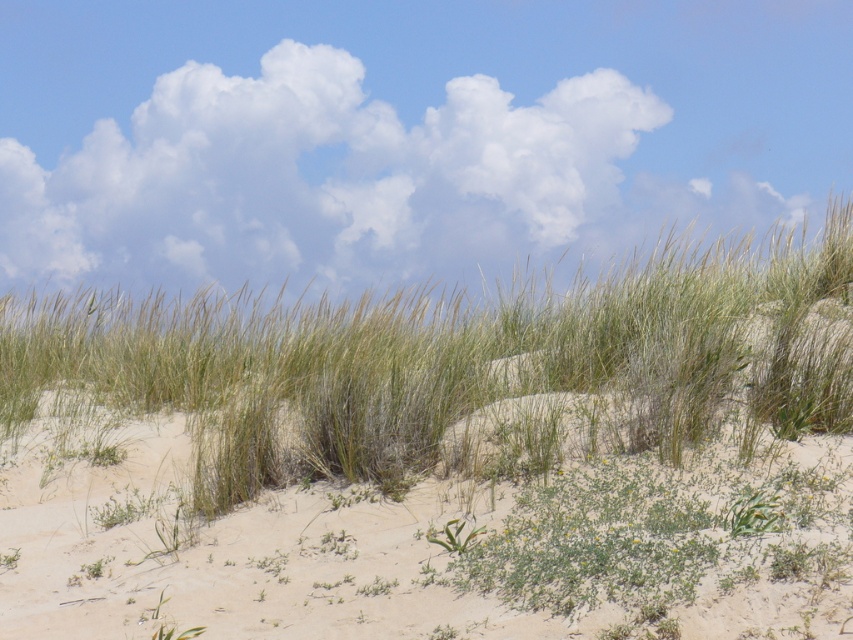
Question: Which point is farther from the camera taking this photo?

Choices:
 (A) (239, 326)
 (B) (676, 109)

Answer: (B)

Question: Is the position of green grass at center more distant than that of white fluffy cloud at upper center?

Choices:
 (A) no
 (B) yes

Answer: (A)

Question: Which object appears closest to the camera in this image?

Choices:
 (A) white fluffy cloud at upper center
 (B) green grass at center

Answer: (B)

Question: Is green grass at center further to camera compared to white fluffy cloud at upper center?

Choices:
 (A) no
 (B) yes

Answer: (A)

Question: Among these objects, which one is farthest from the camera?

Choices:
 (A) green grass at center
 (B) white fluffy cloud at upper center

Answer: (B)

Question: Is green grass at center bigger than white fluffy cloud at upper center?

Choices:
 (A) yes
 (B) no

Answer: (B)